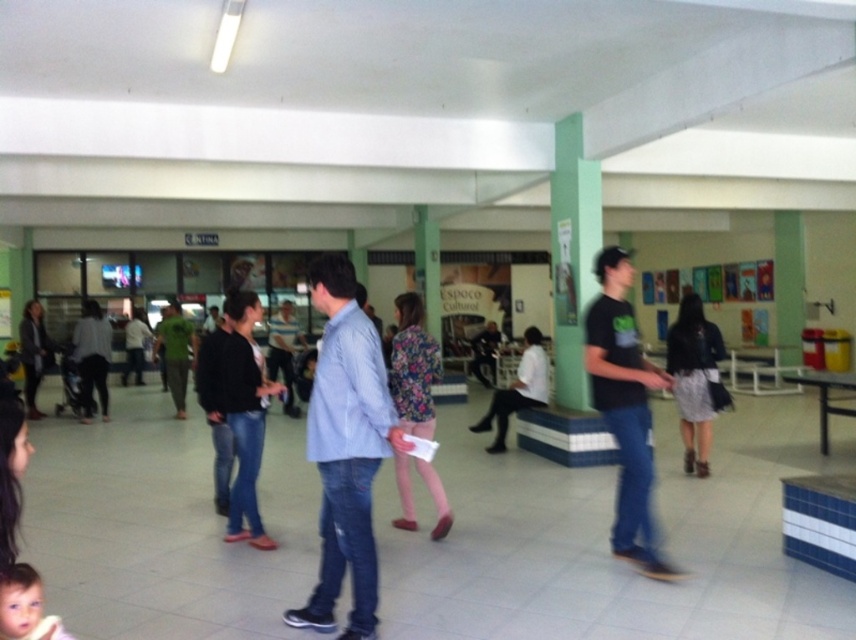
Question: Does smooth skin baby at lower left appear on the left side of dark gray sweater at left?

Choices:
 (A) yes
 (B) no

Answer: (B)

Question: Estimate the real-world distances between objects in this image. Which object is closer to the dark gray sweater at left?

Choices:
 (A) matte black shirt at center
 (B) floral fabric dress at center

Answer: (B)

Question: Which point is closer to the camera?

Choices:
 (A) (40, 582)
 (B) (175, 349)

Answer: (A)

Question: Which point is closer to the camera taking this photo?

Choices:
 (A) (516, 385)
 (B) (259, 316)
 (C) (391, 348)
 (D) (324, 573)

Answer: (D)

Question: Is the position of matte black shirt at center more distant than that of white shirt at center?

Choices:
 (A) no
 (B) yes

Answer: (A)

Question: Is matte black shirt at center smaller than jeans at center?

Choices:
 (A) yes
 (B) no

Answer: (A)